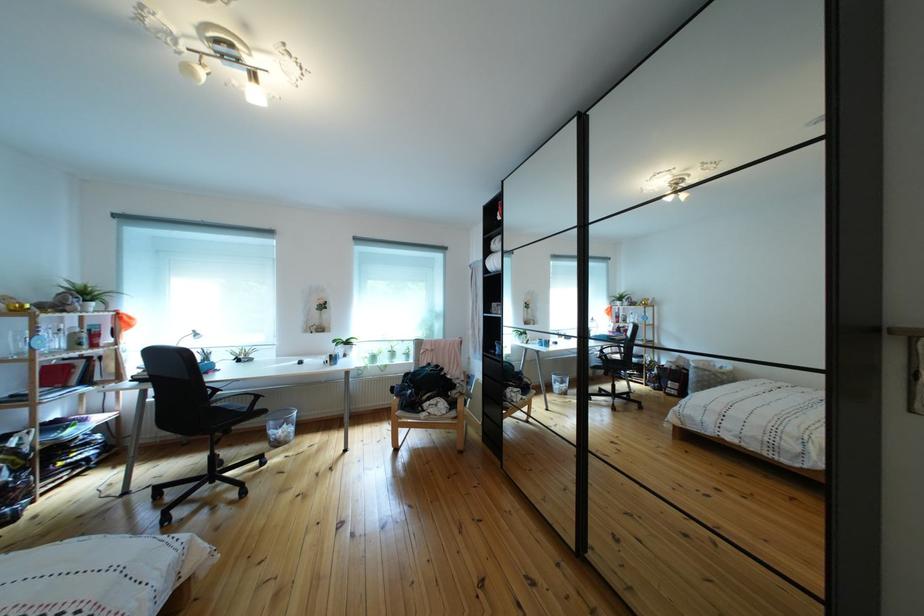
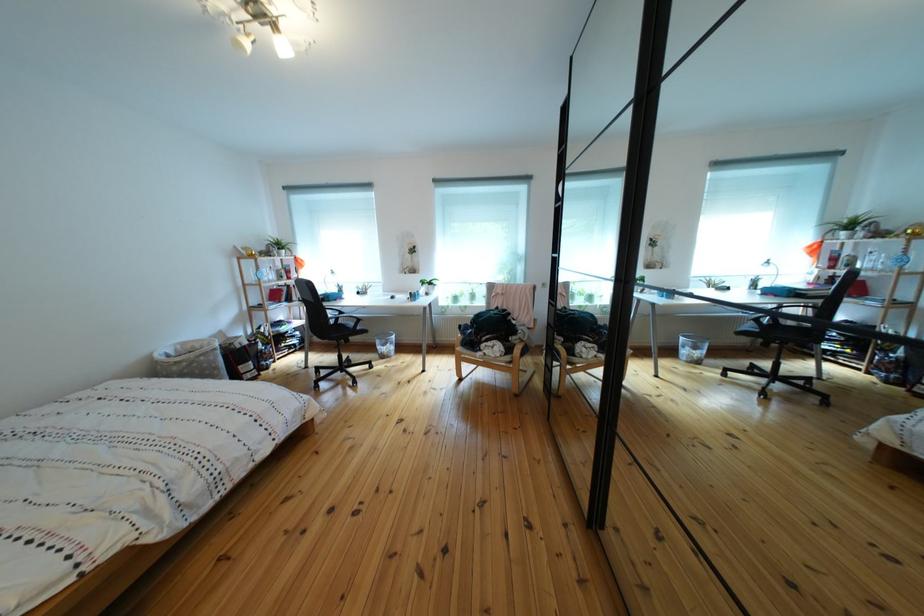
The point at (64, 358) is marked in the first image. Where is the corresponding point in the second image?

(282, 286)